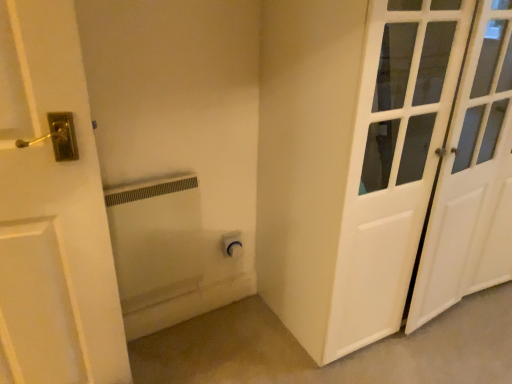
Question: Is white matte outlet at lower center a part of white glossy door at right?

Choices:
 (A) no
 (B) yes

Answer: (A)

Question: From a real-world perspective, is white glossy door at right physically below white matte outlet at lower center?

Choices:
 (A) yes
 (B) no

Answer: (B)

Question: Are white glossy door at right and white matte outlet at lower center far apart?

Choices:
 (A) no
 (B) yes

Answer: (A)

Question: Could you tell me if white glossy door at right is turned towards white matte outlet at lower center?

Choices:
 (A) yes
 (B) no

Answer: (B)

Question: From the image's perspective, is white glossy door at right under white matte outlet at lower center?

Choices:
 (A) no
 (B) yes

Answer: (A)

Question: From the image's perspective, is white glossy door at right above white matte outlet at lower center?

Choices:
 (A) no
 (B) yes

Answer: (B)

Question: Is white matte radiator at center taller than white matte outlet at lower center?

Choices:
 (A) yes
 (B) no

Answer: (A)

Question: Is white matte radiator at center outside white matte outlet at lower center?

Choices:
 (A) yes
 (B) no

Answer: (A)

Question: Considering the relative sizes of white matte radiator at center and white matte outlet at lower center in the image provided, is white matte radiator at center bigger than white matte outlet at lower center?

Choices:
 (A) no
 (B) yes

Answer: (A)

Question: From the image's perspective, is white matte radiator at center under white matte outlet at lower center?

Choices:
 (A) yes
 (B) no

Answer: (B)

Question: Can you confirm if white matte radiator at center is thinner than white matte outlet at lower center?

Choices:
 (A) no
 (B) yes

Answer: (B)

Question: Is white matte radiator at center smaller than white matte outlet at lower center?

Choices:
 (A) no
 (B) yes

Answer: (B)

Question: Considering the relative positions of white matte radiator at center and white glossy door at right in the image provided, is white matte radiator at center to the left of white glossy door at right from the viewer's perspective?

Choices:
 (A) yes
 (B) no

Answer: (A)